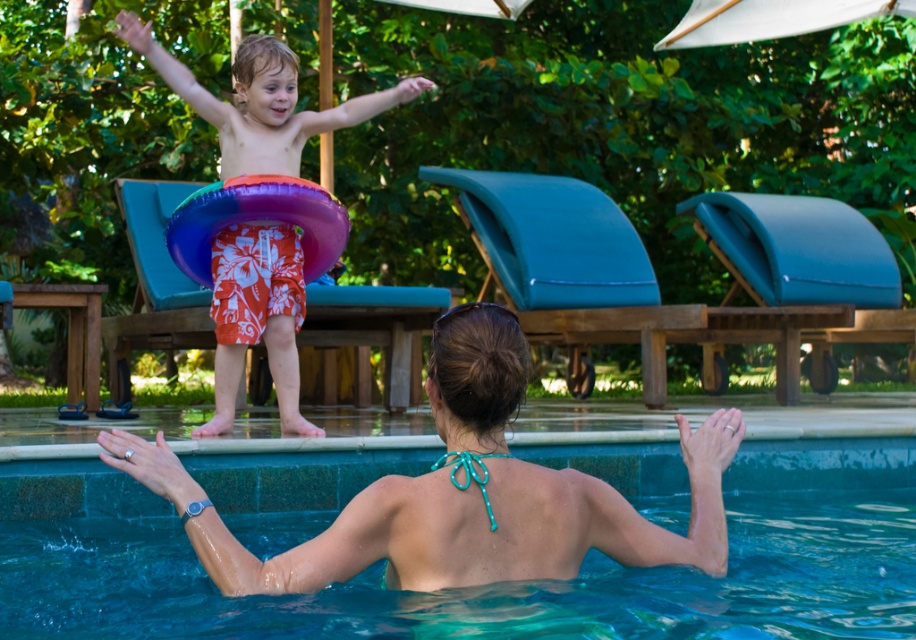
You are a lifeguard standing at the edge of the pool. You see two points marked in the scene. The first point is at coordinates point (254, 64) and the second is at point (784, 32). Which point is closer to you?

Point (254, 64) is in front of point (784, 32), so it is closer to you.

You are a photographer taking a picture of the blue smooth water at upper center and the teal fabric bikini top at upper center. Which object is positioned higher in the frame?

The teal fabric bikini top at upper center is positioned higher in the frame than the blue smooth water at upper center, as it is located above it.